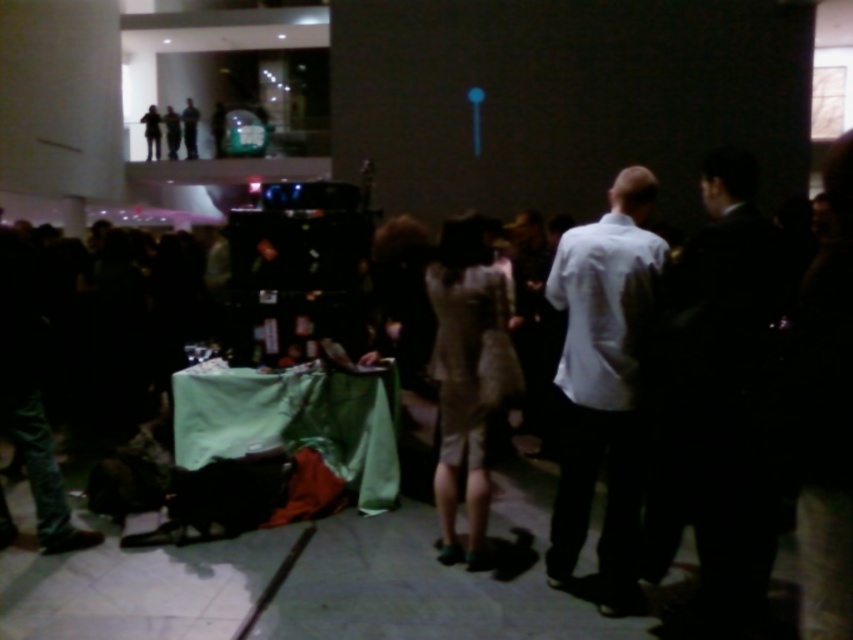
Question: Which of the following is the farthest from the observer?

Choices:
 (A) dark suit at right
 (B) white matte shirt at center

Answer: (B)

Question: Which point appears farthest from the camera in this image?

Choices:
 (A) (729, 573)
 (B) (618, 604)

Answer: (B)

Question: Is dark suit at right bigger than white matte shirt at center?

Choices:
 (A) no
 (B) yes

Answer: (B)

Question: Does dark suit at right have a greater width compared to white matte shirt at center?

Choices:
 (A) no
 (B) yes

Answer: (B)

Question: Does dark suit at right appear on the right side of white matte shirt at center?

Choices:
 (A) yes
 (B) no

Answer: (A)